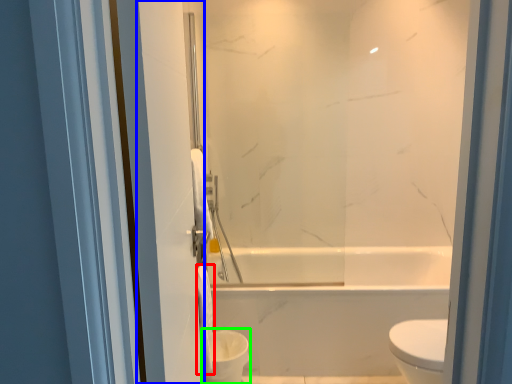
Question: Which object is positioned farthest from toilet paper (highlighted by a red box)? Select from screen door (highlighted by a blue box) and toilet bowl (highlighted by a green box).

Choices:
 (A) screen door
 (B) toilet bowl

Answer: (A)